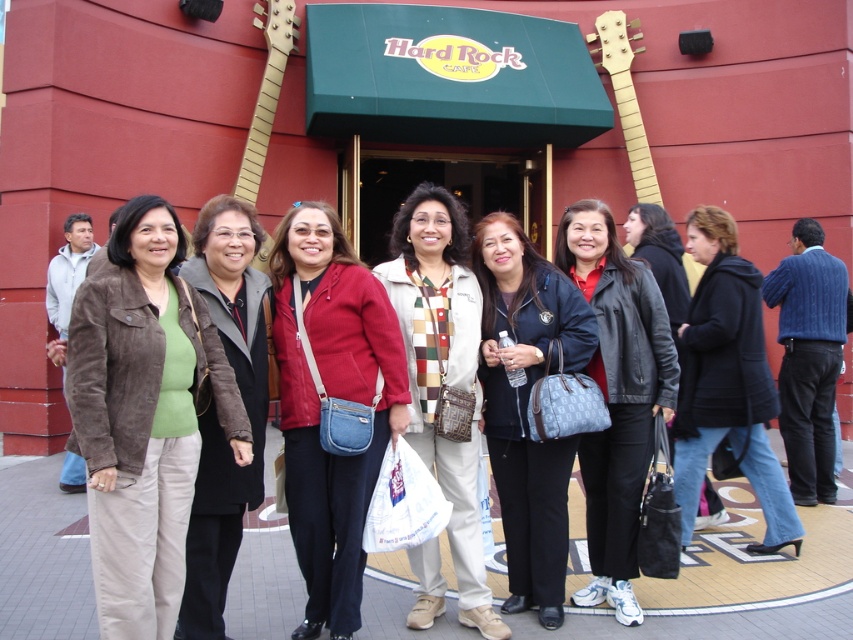
You are standing at the entrance of the Hard Rock Cafe. You see a point marked at coordinates (618, 396). What object is located at that point?

The point at coordinates (618, 396) marks the leather jacket at center.

You are standing in front of the Hard Rock Cafe entrance. There is a point marked at coordinates (143, 416). What object is located at this point?

The point at coordinates (143, 416) indicates the location of the suede brown jacket at center.

You are a photographer trying to frame a shot of the two jackets mentioned. Since the leather jacket at center and the dark blue jacket at center are both at the center, which one should you focus on first to ensure both fit in the frame?

The leather jacket at center is narrower than the dark blue jacket at center, so focusing on the wider dark blue jacket at center first would ensure both fit in the frame.